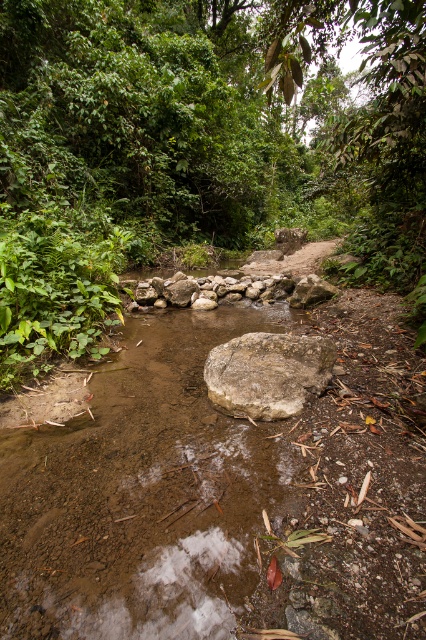
Is gray rough rock at center taller than natural stone at center?

Incorrect, gray rough rock at center's height is not larger of natural stone at center's.

From the picture: Between gray rough rock at center and natural stone at center, which one has more height?

natural stone at center is taller.

Between point (247, 342) and point (176, 298), which one is positioned behind?

Point (176, 298)

Find the location of `gray rough rock at center`. gray rough rock at center is located at coordinates (267, 372).